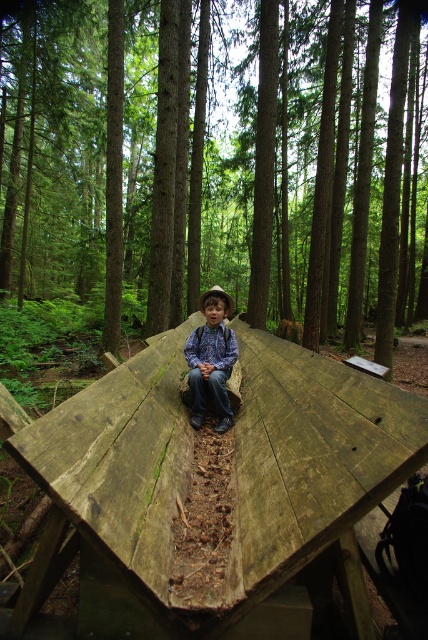
Question: Is wooden log at center closer to the viewer compared to blue denim jeans at center?

Choices:
 (A) no
 (B) yes

Answer: (A)

Question: Which of the following is the closest to the observer?

Choices:
 (A) blue denim jeans at center
 (B) wooden plank at center
 (C) wooden log at center

Answer: (B)

Question: Is wooden log at center above wooden plank at center?

Choices:
 (A) yes
 (B) no

Answer: (A)

Question: Is wooden plank at center smaller than blue denim jeans at center?

Choices:
 (A) no
 (B) yes

Answer: (A)

Question: Which point appears farthest from the camera in this image?

Choices:
 (A) (214, 314)
 (B) (202, 636)
 (C) (142, 195)

Answer: (C)

Question: Which object is the farthest from the blue denim jeans at center?

Choices:
 (A) wooden log at center
 (B) wooden plank at center

Answer: (A)